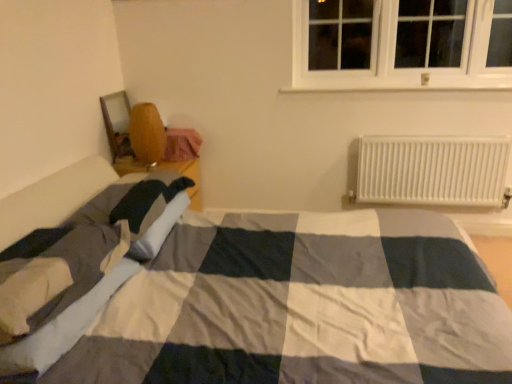
Question: From their relative heights in the image, would you say wooden chair at left is taller or shorter than white plastic radiator at right?

Choices:
 (A) tall
 (B) short

Answer: (B)

Question: Considering the positions of point (183, 130) and point (480, 183), is point (183, 130) closer or farther from the camera than point (480, 183)?

Choices:
 (A) farther
 (B) closer

Answer: (A)

Question: Estimate the real-world distances between objects in this image. Which object is closer to the wooden chair at left?

Choices:
 (A) white cotton blanket at lower left
 (B) white plastic radiator at right

Answer: (A)

Question: Based on their relative distances, which object is farther from the white plastic radiator at right?

Choices:
 (A) white cotton blanket at lower left
 (B) wooden chair at left

Answer: (A)